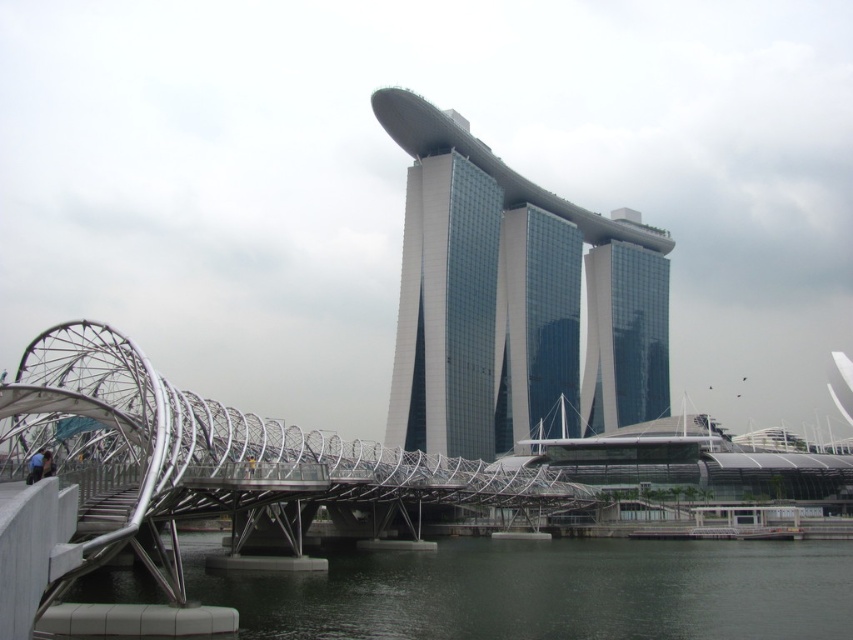
You are a photographer planning to capture the Marina Bay Sands hotel and the Helix Bridge in a single shot. Given that the dark gray water at lower center is wider than the glassy reflective skyscraper at center, which object should you position closer to the edge of your camera frame to ensure both are fully visible?

You should position the glassy reflective skyscraper at center closer to the edge of your camera frame because the dark gray water at lower center is wider, so placing the narrower skyscraper near the edge allows both objects to fit within the frame.

You are a photographer planning to capture the Marina Bay Sands hotel and the Helix Bridge in a single shot. Given that the glassy steel skyscraper at center is narrower than the dark gray water at lower center, which object should you focus on to ensure both are visible in your composition?

Since the glassy steel skyscraper at center is narrower than the dark gray water at lower dark gray water at lower center, you should focus on the glassy steel skyscraper at center to ensure both objects fit within the frame.

You are standing at the Marina Bay Sands hotel and want to take a photo of the dark gray water at lower center. If your camera can focus on objects up to 120 feet away, will you need to move closer to capture a clear image?

The dark gray water at lower center is 125.33 feet away from the viewer. Since the camera can only focus up to 120 feet, you will need to move closer to ensure the water is within the camera range.